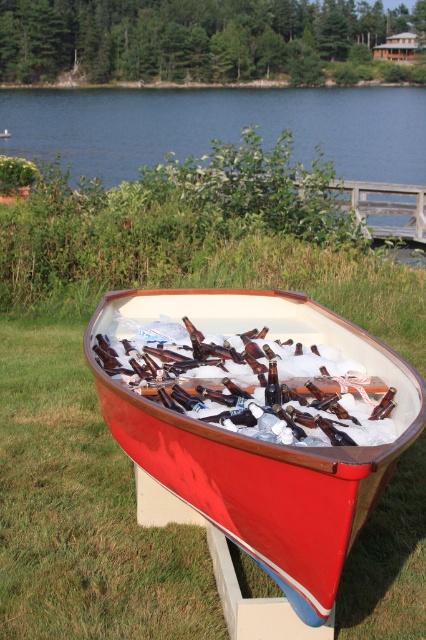
You are standing at the point with coordinates (255, 429) in the image. What object are you directly facing?

The point at coordinates (255, 429) corresponds to the shiny red canoe at center, so you are directly facing the shiny red canoe at center.

You are standing in front of the red canoe on the grassy area. You notice two points marked in the image. Which point, point (180, 355) or point (302, 147), is closer to you?

Point (180, 355) is closer to you than point (302, 147).